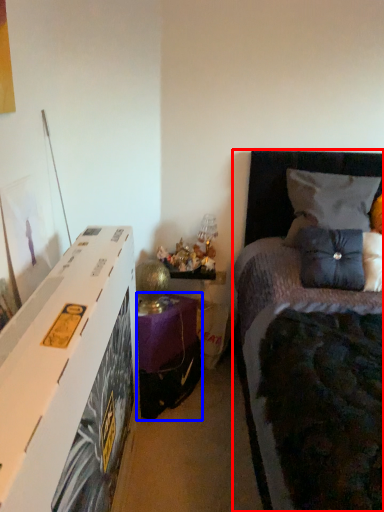
Question: Which point is closer to the camera, bed (highlighted by a red box) or nightstand (highlighted by a blue box)?

Choices:
 (A) bed
 (B) nightstand

Answer: (A)